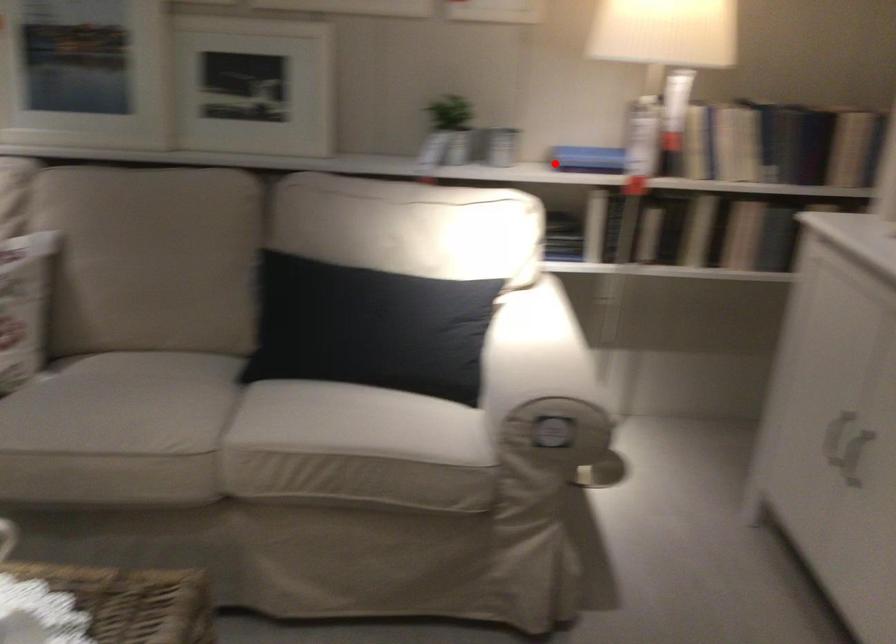
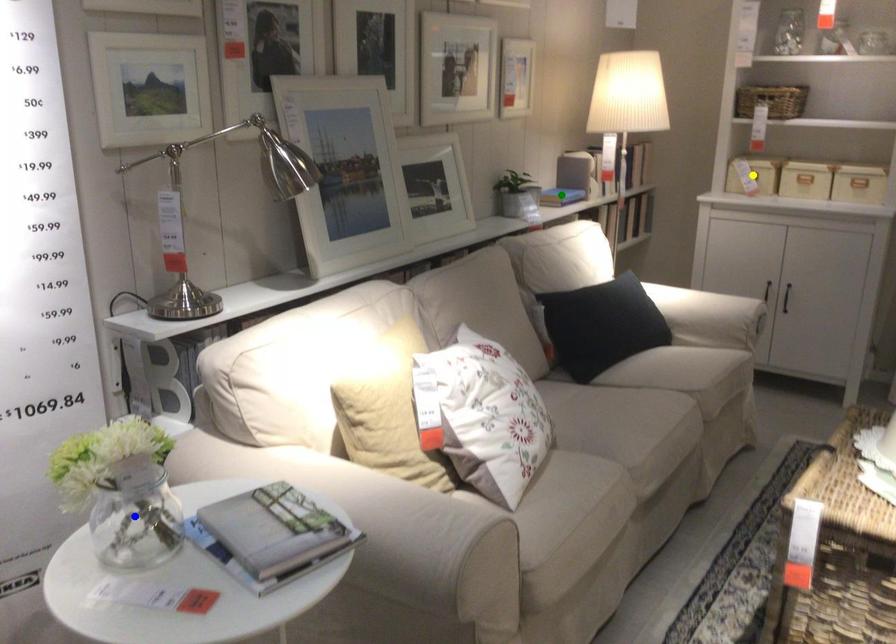
Question: I am providing you with two images of the same scene from different viewpoints. A red point is marked on the first image. You are given multiple points on the second image. Can you choose the point in image 2 that corresponds to the point in image 1?

Choices:
 (A) green point
 (B) blue point
 (C) yellow point

Answer: (A)